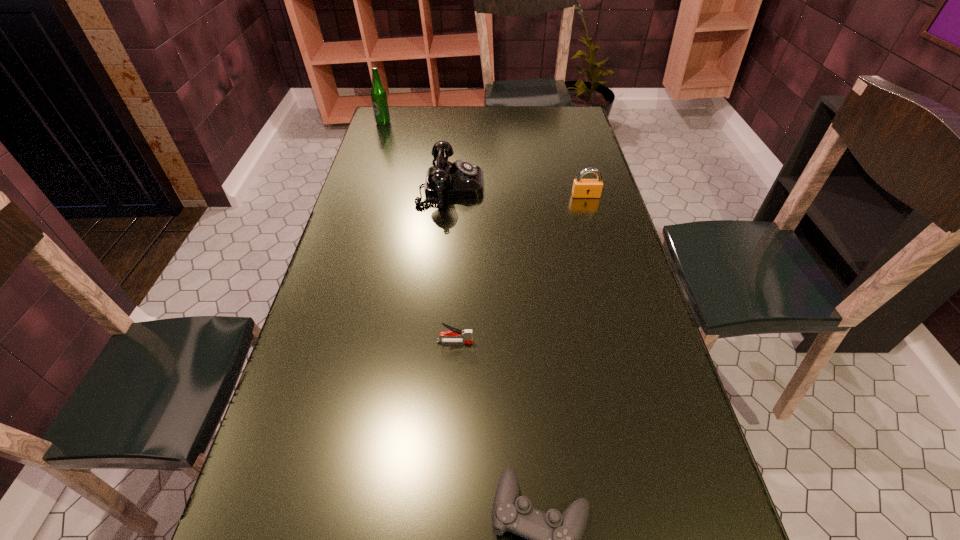
The image size is (960, 540). Find the location of `the farthest object`. the farthest object is located at coordinates (378, 94).

What are the coordinates of `beer bottle` in the screenshot? It's located at (378, 94).

Locate an element on the screen. The width and height of the screenshot is (960, 540). the second tallest object is located at coordinates (461, 179).

Find the location of `the third tallest object`. the third tallest object is located at coordinates (582, 188).

At what (x,y) coordinates should I click in order to perform the action: click on the rightmost object. Please return your answer as a coordinate pair (x, y). This screenshot has height=540, width=960. Looking at the image, I should click on (582, 188).

The height and width of the screenshot is (540, 960). Identify the location of stapler. (466, 335).

Where is `the fourth farthest object`? This screenshot has width=960, height=540. the fourth farthest object is located at coordinates (466, 335).

What are the coordinates of `vacant area situated on the label of the tallest object` in the screenshot? It's located at (374, 150).

Find the location of a particular element. The image size is (960, 540). vacant space located 0.140m on the dial of the fourth shortest object is located at coordinates (526, 187).

Where is `vacant space located 0.090m to unlock the third shortest object from the front`? The width and height of the screenshot is (960, 540). vacant space located 0.090m to unlock the third shortest object from the front is located at coordinates (591, 216).